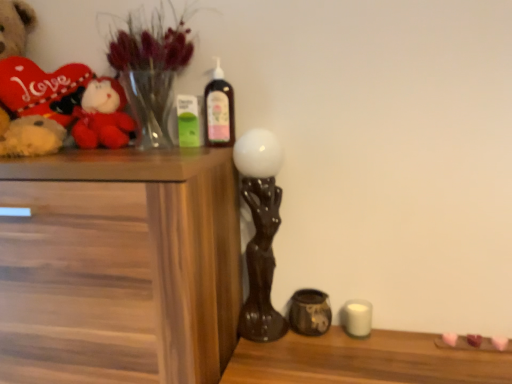
What are the coordinates of `unoccupied area in front of translucent glass vase at upper left` in the screenshot? It's located at (136, 157).